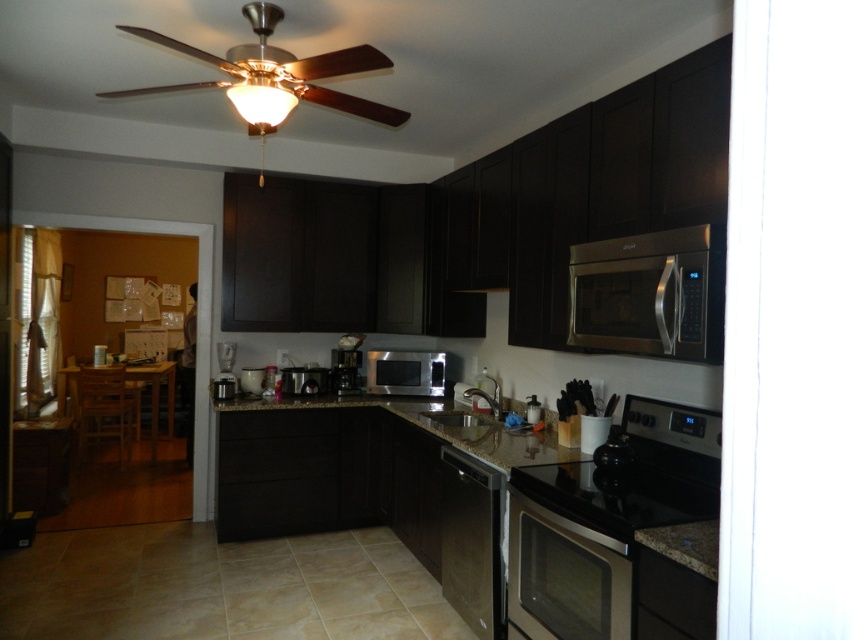
Question: Considering the real-world distances, which object is closest to the satin black microwave at center?

Choices:
 (A) satin silver microwave at center
 (B) satin black coffee maker at center
 (C) wooden ceiling fan at upper center

Answer: (B)

Question: Is stainless steel dishwasher at lower center positioned at the back of satin black microwave at center?

Choices:
 (A) no
 (B) yes

Answer: (A)

Question: Based on their relative distances, which object is farther from the matte white crock pot at center?

Choices:
 (A) stainless steel oven at lower center
 (B) satin black microwave at center
 (C) stainless steel microwave at upper right

Answer: (C)

Question: Can you confirm if granite countertop at center is positioned above satin silver microwave at center?

Choices:
 (A) yes
 (B) no

Answer: (B)

Question: Is wooden ceiling fan at upper center behind satin silver microwave at center?

Choices:
 (A) no
 (B) yes

Answer: (A)

Question: Which object is positioned farthest from the granite countertop at center?

Choices:
 (A) wooden ceiling fan at upper center
 (B) stainless steel dishwasher at lower center
 (C) matte white crock pot at center

Answer: (A)